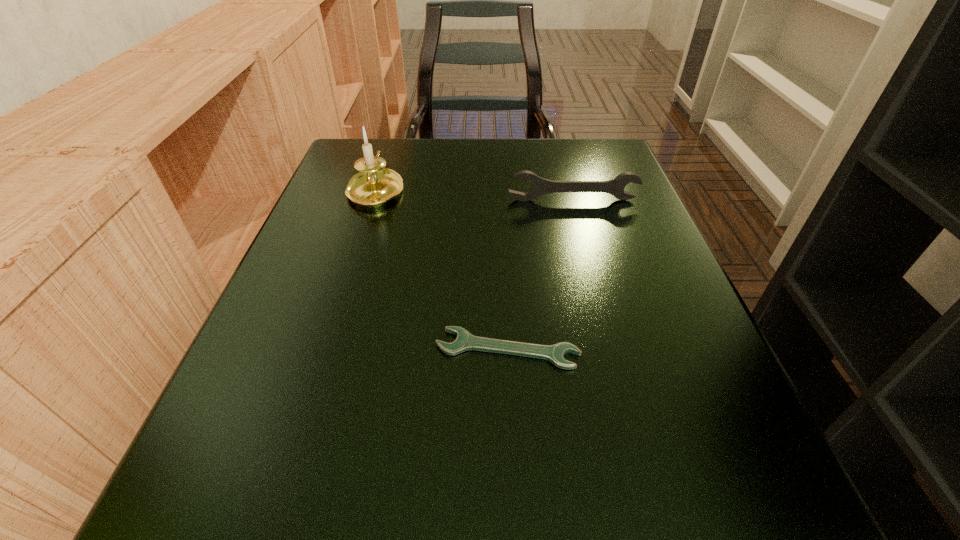
Where is `free space between the shortest object and the tallest object`? The image size is (960, 540). free space between the shortest object and the tallest object is located at coordinates (442, 269).

In order to click on free spot between the candle holder and the nearest object in this screenshot , I will do `click(442, 269)`.

What are the coordinates of `object that is the closest to the shortest object` in the screenshot? It's located at (374, 185).

Identify which object is the nearest to the farther wrench. Please provide its 2D coordinates. Your answer should be formatted as a tuple, i.e. [(x, y)], where the tuple contains the x and y coordinates of a point satisfying the conditions above.

[(374, 185)]